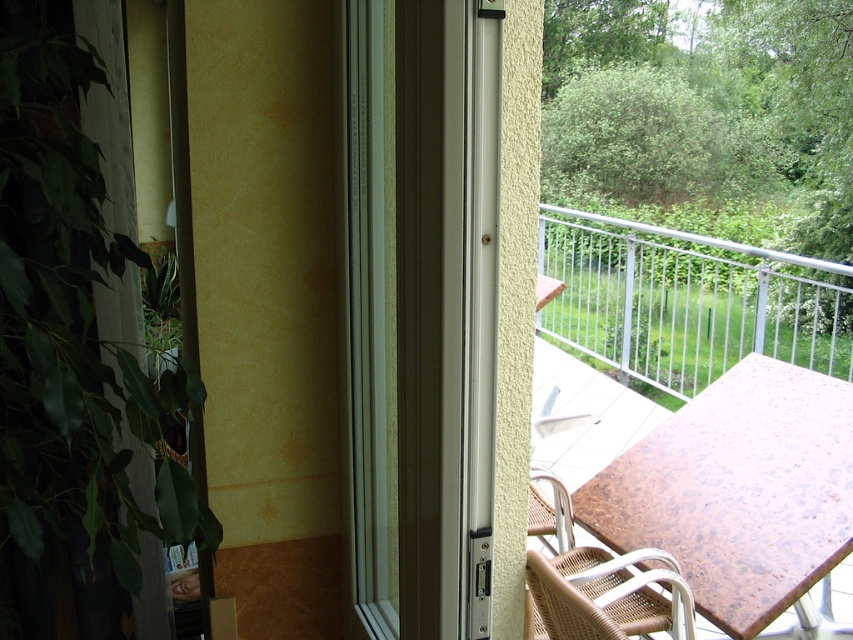
Question: Which point appears farthest from the camera in this image?

Choices:
 (A) (467, 445)
 (B) (635, 632)
 (C) (657, 426)

Answer: (C)

Question: Which of the following is the closest to the observer?

Choices:
 (A) (643, 529)
 (B) (479, 284)
 (C) (436, 45)

Answer: (C)

Question: Does white plastic screen door at center lie in front of brown marble table at center?

Choices:
 (A) no
 (B) yes

Answer: (B)

Question: Which point is closer to the camera?

Choices:
 (A) brown marble table at center
 (B) white plastic screen door at center
 (C) white metallic screen door at center
 (D) woven brown chair at lower right

Answer: (B)

Question: In this image, where is white plastic screen door at center located relative to woven brown chair at lower right?

Choices:
 (A) right
 (B) left

Answer: (B)

Question: Does white plastic screen door at center appear over brown marble table at center?

Choices:
 (A) no
 (B) yes

Answer: (B)